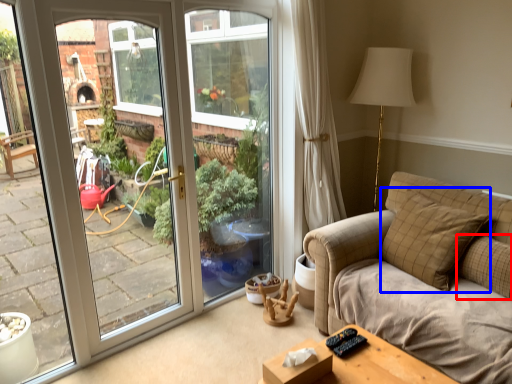
Question: Which object is closer to the camera taking this photo, pillow (highlighted by a red box) or pillow (highlighted by a blue box)?

Choices:
 (A) pillow
 (B) pillow

Answer: (A)